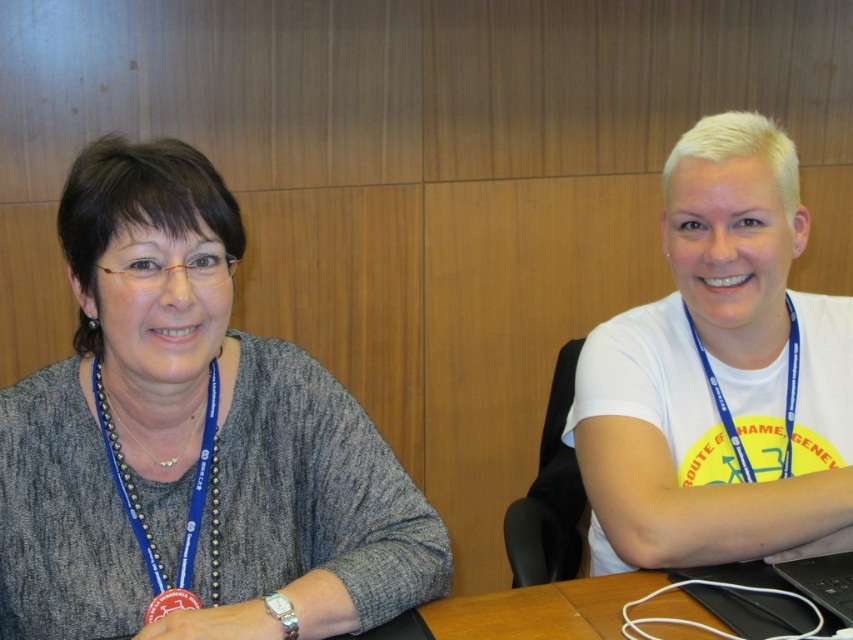
Question: Does white matte t-shirt at center appear on the left side of blue fabric lanyard at upper right?

Choices:
 (A) no
 (B) yes

Answer: (B)

Question: Considering the relative positions of matte gray sweater at left and blue fabric lanyard at upper right in the image provided, where is matte gray sweater at left located with respect to blue fabric lanyard at upper right?

Choices:
 (A) below
 (B) above

Answer: (A)

Question: Does white matte t-shirt at center have a lesser width compared to blue fabric lanyard at upper right?

Choices:
 (A) yes
 (B) no

Answer: (B)

Question: Which point is closer to the camera?

Choices:
 (A) (140, 292)
 (B) (656, 432)
 (C) (146, 612)
 (D) (711, 388)

Answer: (A)

Question: Which object appears closest to the camera in this image?

Choices:
 (A) matte gray sweater at left
 (B) white matte t-shirt at center
 (C) blue fabric lanyard at upper right

Answer: (A)

Question: Which point is farther to the camera?

Choices:
 (A) (741, 529)
 (B) (212, 548)
 (C) (796, 371)
 (D) (190, 566)

Answer: (C)